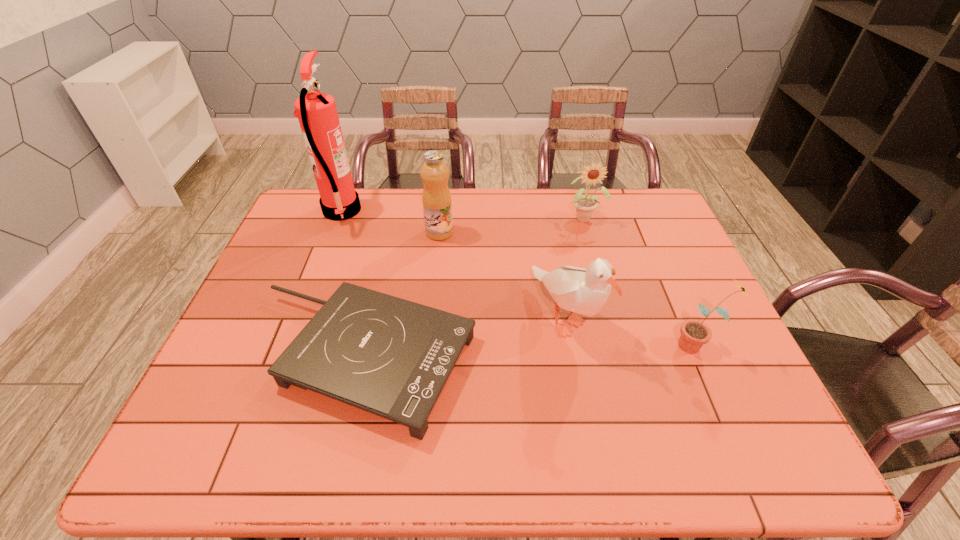
You are a GUI agent. You are given a task and a screenshot of the screen. Output one action in this format:
    pyautogui.click(x=<x>, y=<y>)
    Task: Click on the fire extinguisher
    
    Given the screenshot: What is the action you would take?
    pyautogui.click(x=317, y=113)

You are a GUI agent. You are given a task and a screenshot of the screen. Output one action in this format:
    pyautogui.click(x=<x>, y=<y>)
    Task: Click on the fruit juice
    
    Given the screenshot: What is the action you would take?
    pyautogui.click(x=437, y=206)

Identify the location of gull. Image resolution: width=960 pixels, height=540 pixels. (584, 291).

Locate an element on the screen. This screenshot has height=540, width=960. the left sunflower is located at coordinates (585, 205).

At what (x,y) coordinates should I click in order to perform the action: click on the rightmost object. Please return your answer as a coordinate pair (x, y). Looking at the image, I should click on (694, 334).

Identify the location of the right sunflower. The width and height of the screenshot is (960, 540). (694, 334).

This screenshot has width=960, height=540. In order to click on the shortest object in this screenshot , I will do `click(391, 357)`.

Locate an element on the screen. This screenshot has width=960, height=540. free space located with the nozzle aimed from the fire extinguisher is located at coordinates (405, 211).

At what (x,y) coordinates should I click in order to perform the action: click on vacant space located 0.060m on the front label of the fruit juice. Please return your answer as a coordinate pair (x, y). Image resolution: width=960 pixels, height=540 pixels. Looking at the image, I should click on (472, 233).

The width and height of the screenshot is (960, 540). I want to click on vacant position located 0.210m at the beak of the gull, so click(x=588, y=449).